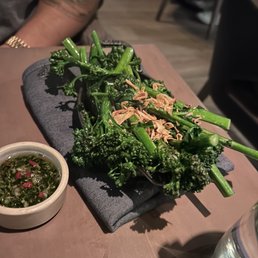
At what (x,y) coordinates should I click in order to perform the action: click on table. Please return your answer as a coordinate pair (x, y). This screenshot has width=258, height=258. Looking at the image, I should click on (79, 234).